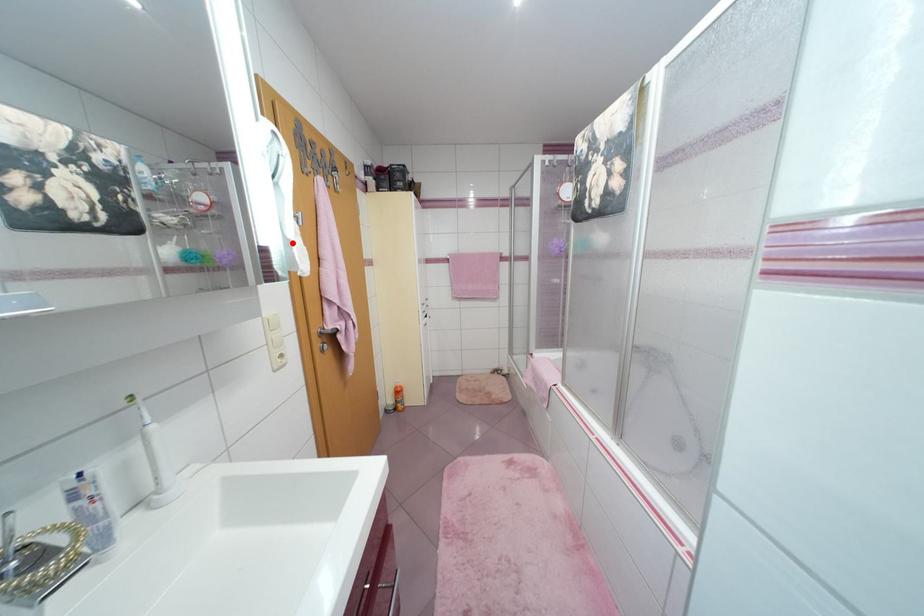
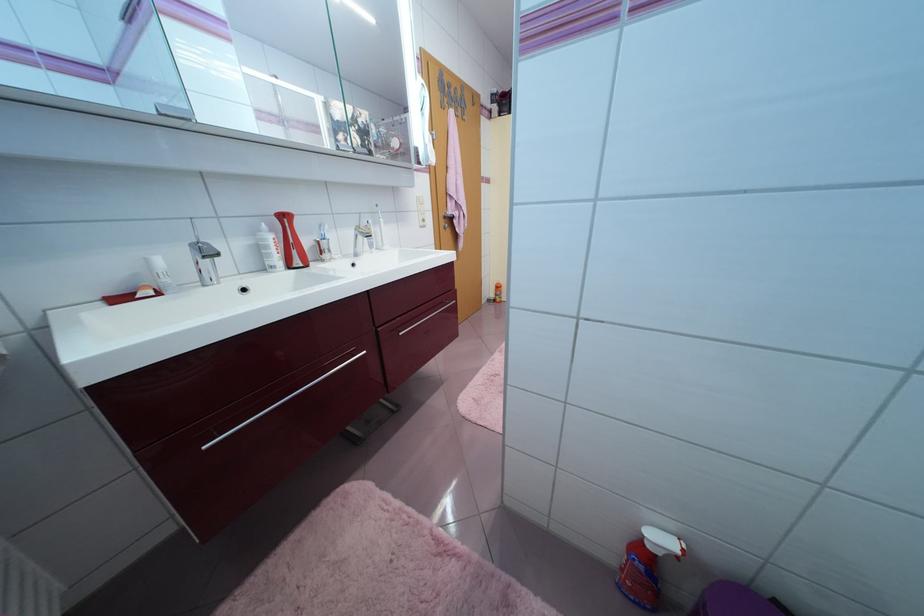
In the second image, find the point that corresponds to the highlighted location in the first image.

(431, 147)